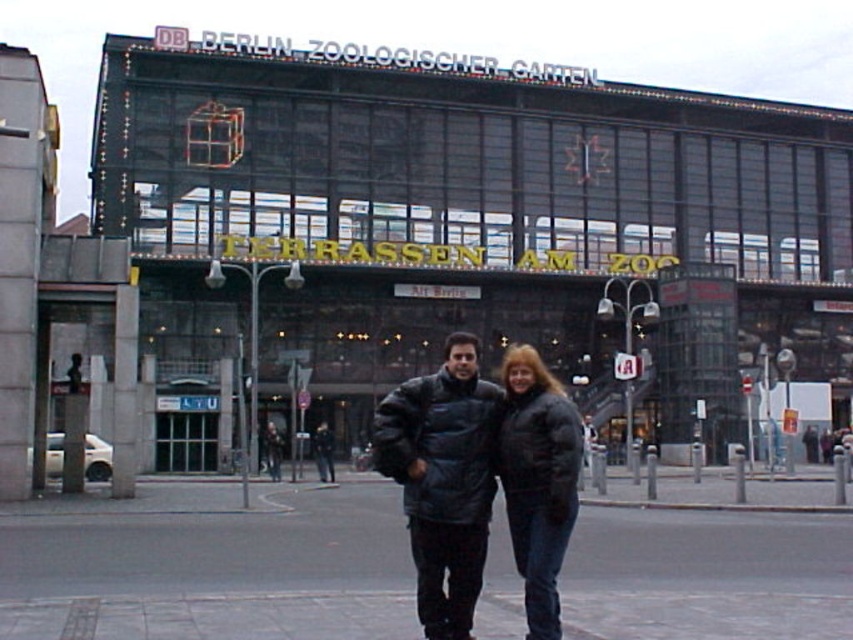
You are standing in front of the DB Berlin Zoologischer Garten building and want to determine the relative positions of two points marked on the facade. Which of the two points, point 1 at coordinates point (132, 572) or point 2 at coordinates point (567, 484), is closer to you?

Point 1 at coordinates point (132, 572) is closer to you because it is further to the viewer than point 2 at coordinates point (567, 484).